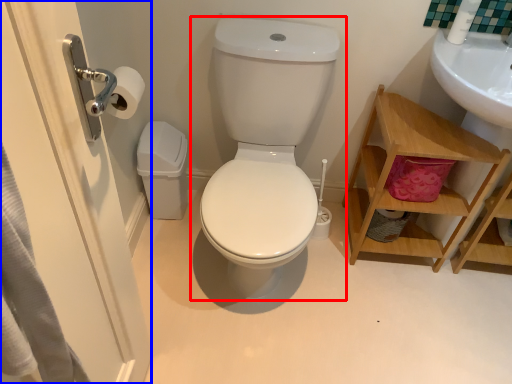
Question: Which object is further to the camera taking this photo, toilet (highlighted by a red box) or screen door (highlighted by a blue box)?

Choices:
 (A) toilet
 (B) screen door

Answer: (A)